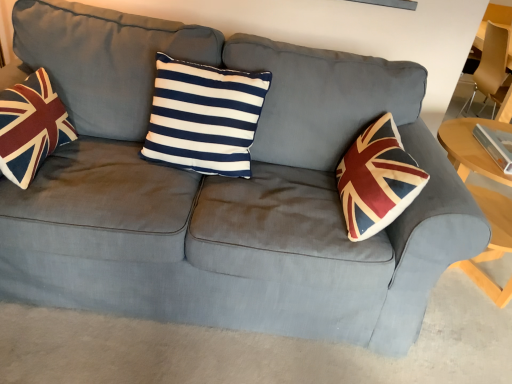
Question: Looking at their shapes, would you say velvet union jack pillow at left is wider or thinner than navy/white striped cushion at center?

Choices:
 (A) wide
 (B) thin

Answer: (A)

Question: From the image's perspective, is velvet union jack pillow at left above or below navy/white striped cushion at center?

Choices:
 (A) below
 (B) above

Answer: (A)

Question: Which of these objects is positioned farthest from the light wood table at right?

Choices:
 (A) velvet union jack pillow at left
 (B) navy/white striped cushion at center
 (C) matte brown armchair at right

Answer: (A)

Question: Considering the real-world distances, which object is farthest from the light wood table at right?

Choices:
 (A) velvet union jack pillow at left
 (B) matte brown armchair at right
 (C) navy/white striped cushion at center

Answer: (A)